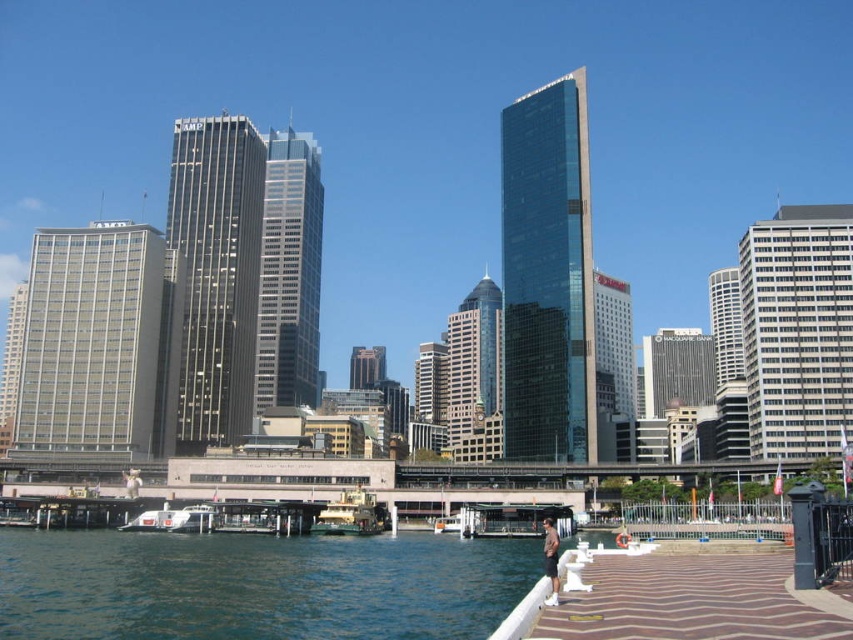
Question: Does green water at lower left have a lesser width compared to brown textured dock at lower right?

Choices:
 (A) yes
 (B) no

Answer: (B)

Question: Can you confirm if metallic silver boat at center is wider than white glossy boat at lower left?

Choices:
 (A) yes
 (B) no

Answer: (B)

Question: Which object is closer to the camera taking this photo?

Choices:
 (A) white cotton shirt at lower left
 (B) metallic silver boat at center
 (C) tan leather jacket at lower right
 (D) green metallic ferry at center

Answer: (C)

Question: Estimate the real-world distances between objects in this image. Which object is farther from the metallic silver boat at center?

Choices:
 (A) green metallic ferry at center
 (B) brown textured dock at lower right
 (C) green water at lower left

Answer: (B)

Question: Which object is closer to the camera taking this photo?

Choices:
 (A) green water at lower left
 (B) green metallic ferry at center

Answer: (A)

Question: Is metallic silver boat at center to the left of tan leather jacket at lower right from the viewer's perspective?

Choices:
 (A) yes
 (B) no

Answer: (A)